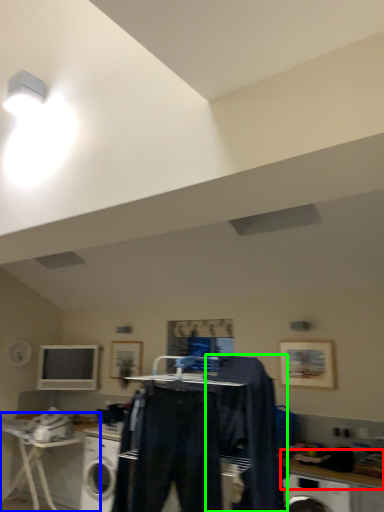
Question: Estimate the real-world distances between objects in this image. Which object is closer to counter top (highlighted by a red box), table (highlighted by a blue box) or clothing (highlighted by a green box)?

Choices:
 (A) table
 (B) clothing

Answer: (B)